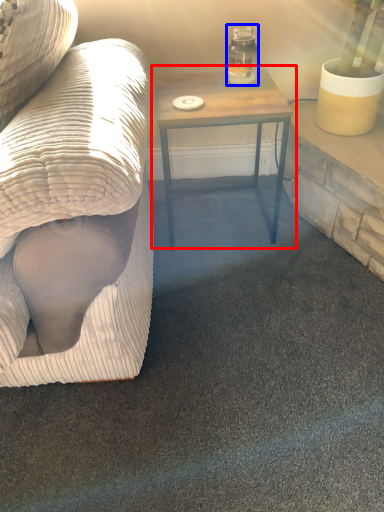
Question: Which object appears closest to the camera in this image, table (highlighted by a red box) or glass jar (highlighted by a blue box)?

Choices:
 (A) table
 (B) glass jar

Answer: (A)